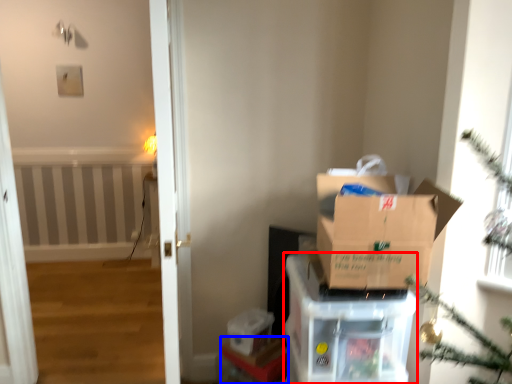
Question: Which point is further to the camera, cardboard box (highlighted by a red box) or furniture (highlighted by a blue box)?

Choices:
 (A) cardboard box
 (B) furniture

Answer: (B)